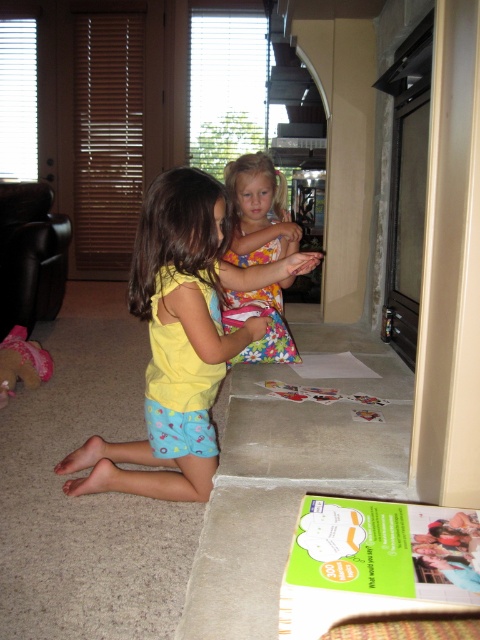
Where is `yellow fabric shirt at center`? This screenshot has height=640, width=480. yellow fabric shirt at center is located at coordinates (180, 339).

Where is `yellow fabric shirt at center`? The height and width of the screenshot is (640, 480). yellow fabric shirt at center is located at coordinates (180, 339).